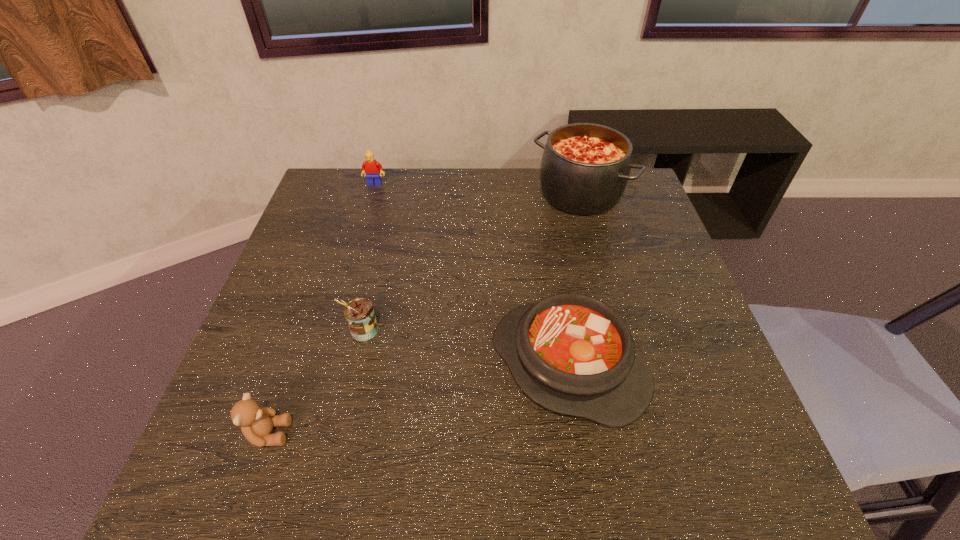
Where is `vacant space in between the Lego and the teddy bear`? vacant space in between the Lego and the teddy bear is located at coordinates (322, 309).

Find the location of `free space between the can and the Lego`. free space between the can and the Lego is located at coordinates (370, 258).

Where is `empty space between the Lego and the teddy bear`? This screenshot has width=960, height=540. empty space between the Lego and the teddy bear is located at coordinates (322, 309).

Locate an element on the screen. free point between the shorter casserole and the teddy bear is located at coordinates (419, 399).

Identify the location of vacant region between the teddy bear and the can. This screenshot has height=540, width=960. (316, 382).

You are a GUI agent. You are given a task and a screenshot of the screen. Output one action in this format:
    pyautogui.click(x=<x>, y=<y>)
    Task: Click on the unoccupied position between the can and the shorter casserole
    Image resolution: width=960 pixels, height=540 pixels.
    Given the screenshot: What is the action you would take?
    pyautogui.click(x=466, y=348)

Where is `free point between the Lego and the teddy bear`? Image resolution: width=960 pixels, height=540 pixels. free point between the Lego and the teddy bear is located at coordinates (322, 309).

Identify the location of object that is the second closest to the can. This screenshot has width=960, height=540. (573, 354).

I want to click on object that is the second closest to the nearer casserole, so click(x=585, y=167).

Where is `vacant space that satisfies the following two spatial constraints: 1. on the face of the Lego; 2. on the face of the teddy bear`? Image resolution: width=960 pixels, height=540 pixels. vacant space that satisfies the following two spatial constraints: 1. on the face of the Lego; 2. on the face of the teddy bear is located at coordinates (303, 433).